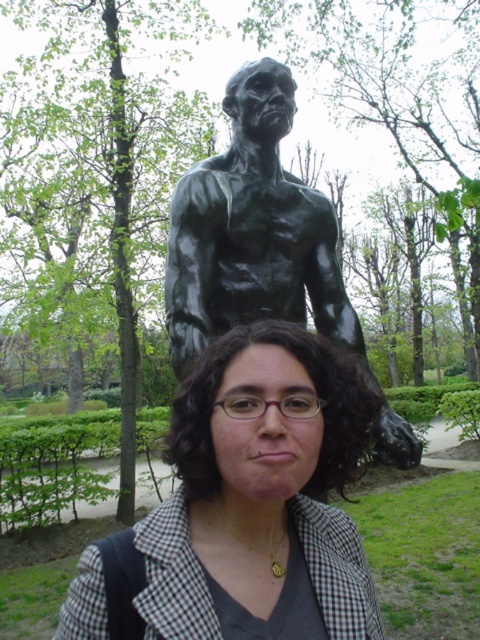
Question: Which point appears closest to the camera in this image?

Choices:
 (A) (343, 316)
 (B) (267, 394)

Answer: (B)

Question: Does matte black jacket at center appear on the left side of bronze statue at center?

Choices:
 (A) no
 (B) yes

Answer: (A)

Question: Which point is farther to the camera?

Choices:
 (A) bronze statue at center
 (B) matte black jacket at center

Answer: (A)

Question: Does matte black jacket at center have a greater width compared to bronze statue at center?

Choices:
 (A) yes
 (B) no

Answer: (B)

Question: Is matte black jacket at center to the left of bronze statue at center from the viewer's perspective?

Choices:
 (A) no
 (B) yes

Answer: (A)

Question: Which object appears closest to the camera in this image?

Choices:
 (A) bronze statue at center
 (B) matte black jacket at center

Answer: (B)